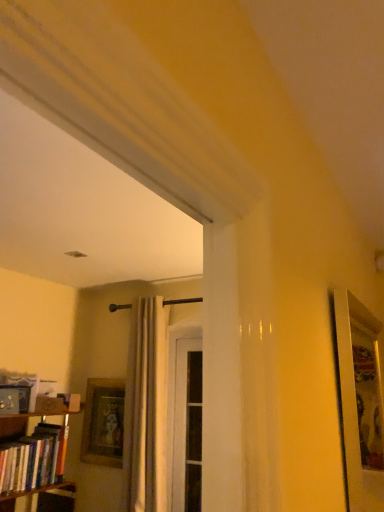
Question: Is hardcover books at left located within white sheer curtain at center?

Choices:
 (A) no
 (B) yes

Answer: (A)

Question: Can you confirm if white sheer curtain at center is bigger than hardcover books at left?

Choices:
 (A) no
 (B) yes

Answer: (B)

Question: From a real-world perspective, does white sheer curtain at center stand above hardcover books at left?

Choices:
 (A) yes
 (B) no

Answer: (A)

Question: Can you confirm if white sheer curtain at center is positioned to the left of hardcover books at left?

Choices:
 (A) yes
 (B) no

Answer: (B)

Question: Is white sheer curtain at center thinner than hardcover books at left?

Choices:
 (A) yes
 (B) no

Answer: (A)

Question: Are white sheer curtain at center and hardcover books at left beside each other?

Choices:
 (A) no
 (B) yes

Answer: (A)

Question: Does wooden picture frame at lower left have a lesser width compared to hardcover books at left?

Choices:
 (A) no
 (B) yes

Answer: (B)

Question: Is wooden picture frame at lower left facing towards hardcover books at left?

Choices:
 (A) no
 (B) yes

Answer: (B)

Question: Is wooden picture frame at lower left placed right next to hardcover books at left?

Choices:
 (A) yes
 (B) no

Answer: (B)

Question: Can hardcover books at left be found inside wooden picture frame at lower left?

Choices:
 (A) no
 (B) yes

Answer: (A)

Question: Considering the relative sizes of wooden picture frame at lower left and hardcover books at left in the image provided, is wooden picture frame at lower left shorter than hardcover books at left?

Choices:
 (A) yes
 (B) no

Answer: (B)

Question: From the image's perspective, is wooden picture frame at lower left located above hardcover books at left?

Choices:
 (A) no
 (B) yes

Answer: (A)

Question: From a real-world perspective, is hardcover books at left on top of white sheer curtain at center?

Choices:
 (A) yes
 (B) no

Answer: (B)